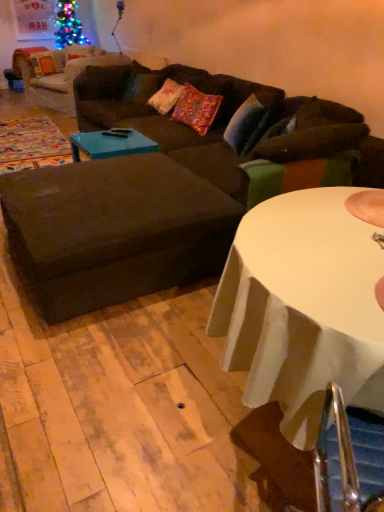
Question: Is blue glossy coffee table at center oriented away from dark brown fabric couch at center?

Choices:
 (A) yes
 (B) no

Answer: (A)

Question: From the image's perspective, is blue glossy coffee table at center beneath dark brown fabric couch at center?

Choices:
 (A) yes
 (B) no

Answer: (A)

Question: Are blue glossy coffee table at center and dark brown fabric couch at center far apart?

Choices:
 (A) yes
 (B) no

Answer: (B)

Question: Does blue glossy coffee table at center have a larger size compared to dark brown fabric couch at center?

Choices:
 (A) no
 (B) yes

Answer: (A)

Question: Is blue glossy coffee table at center wider than dark brown fabric couch at center?

Choices:
 (A) yes
 (B) no

Answer: (B)

Question: Looking at their shapes, would you say white glossy table at center is wider or thinner than blue glossy coffee table at center?

Choices:
 (A) thin
 (B) wide

Answer: (B)

Question: Based on their sizes in the image, would you say white glossy table at center is bigger or smaller than blue glossy coffee table at center?

Choices:
 (A) big
 (B) small

Answer: (A)

Question: Considering the positions of point (301, 393) and point (87, 139), is point (301, 393) closer or farther from the camera than point (87, 139)?

Choices:
 (A) closer
 (B) farther

Answer: (A)

Question: Would you say white glossy table at center is to the left or to the right of blue glossy coffee table at center in the picture?

Choices:
 (A) left
 (B) right

Answer: (B)

Question: Looking at the image, does dark brown fabric couch at center seem bigger or smaller compared to blue glossy coffee table at center?

Choices:
 (A) big
 (B) small

Answer: (A)

Question: Is dark brown fabric couch at center taller or shorter than blue glossy coffee table at center?

Choices:
 (A) short
 (B) tall

Answer: (B)

Question: From the image's perspective, is dark brown fabric couch at center located above or below blue glossy coffee table at center?

Choices:
 (A) above
 (B) below

Answer: (A)

Question: Is point (203, 142) closer or farther from the camera than point (76, 150)?

Choices:
 (A) farther
 (B) closer

Answer: (A)

Question: In terms of height, does dark brown fabric couch at center look taller or shorter compared to floral fabric pillow at center?

Choices:
 (A) short
 (B) tall

Answer: (B)

Question: From a real-world perspective, relative to floral fabric pillow at center, is dark brown fabric couch at center vertically above or below?

Choices:
 (A) below
 (B) above

Answer: (A)